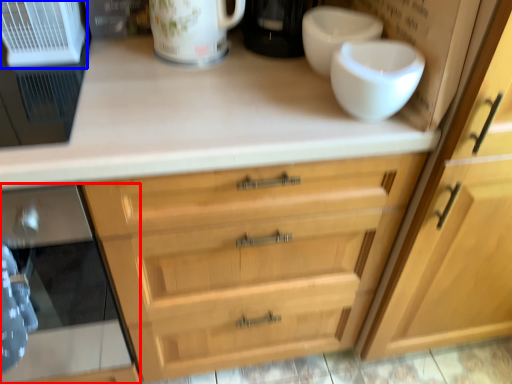
Question: Which point is further to the camera, oven (highlighted by a red box) or appliance (highlighted by a blue box)?

Choices:
 (A) oven
 (B) appliance

Answer: (B)